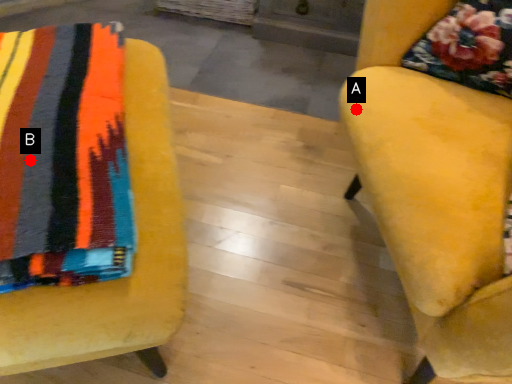
Question: Two points are circled on the image, labeled by A and B beside each circle. Which point is further to the camera?

Choices:
 (A) A is further
 (B) B is further

Answer: (A)